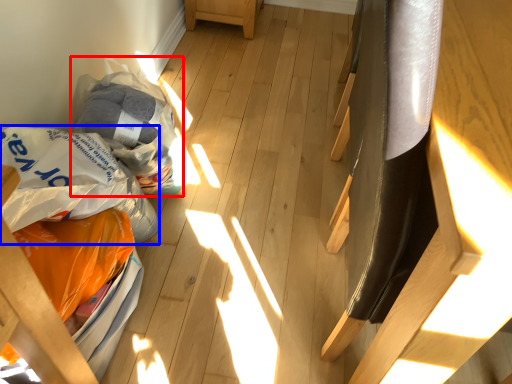
Question: Among these objects, which one is nearest to the camera, grocery bag (highlighted by a red box) or grocery bag (highlighted by a blue box)?

Choices:
 (A) grocery bag
 (B) grocery bag

Answer: (B)